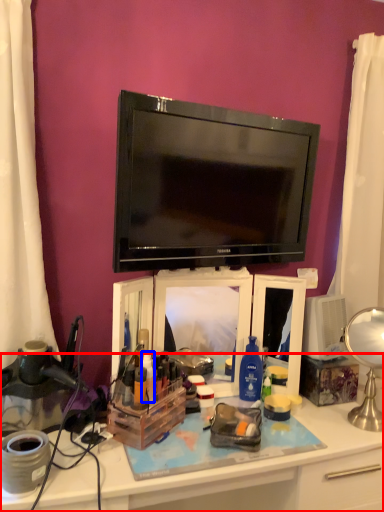
Question: Which point is closer to the camera, desk (highlighted by a red box) or toiletry (highlighted by a blue box)?

Choices:
 (A) desk
 (B) toiletry

Answer: (A)